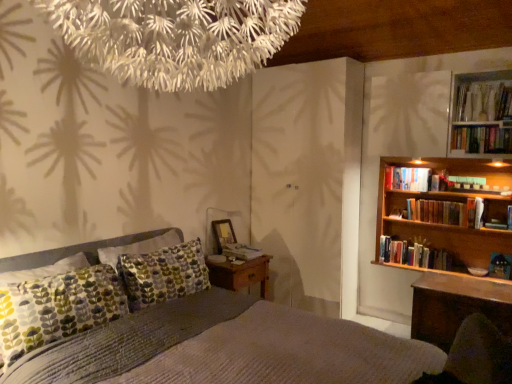
Locate an element on the screen. hardcover books at upper right, the fifth book positioned from the left is located at coordinates (481, 139).

Where is `textured gray bed at center`? This screenshot has height=384, width=512. textured gray bed at center is located at coordinates (229, 348).

Describe the element at coordinates (437, 212) in the screenshot. I see `hardcover books at right, which is the 3th book in bottom-to-top order` at that location.

Locate an element on the screen. hardcover book at bedside, the 6th book in the right-to-left sequence is located at coordinates (241, 252).

In the scene shown: Is wooden table at right not near textured gray bed at center?

Yes, wooden table at right and textured gray bed at center are quite far apart.

Find the location of `table that appears on the right of textured gray bed at center`. table that appears on the right of textured gray bed at center is located at coordinates (456, 306).

Does textured gray bed at center have a greater height compared to hardcover books at upper right, marked as the 6th book in a left-to-right arrangement?

Indeed, textured gray bed at center has a greater height compared to hardcover books at upper right, marked as the 6th book in a left-to-right arrangement.

Measure the distance between textured gray bed at center and hardcover books at upper right, marked as the 6th book in a left-to-right arrangement.

They are 7.17 feet apart.

In the image, there is a hardcover books at upper right, the first book when ordered from right to left. Identify the location of bed below it (from the image's perspective). (229, 348).

Identify the location of book that is the 4th one when counting upward from the textured gray bed at center (from the image's perspective). Image resolution: width=512 pixels, height=384 pixels. (408, 179).

From the image's perspective, is hardcover book at upper right, which is the second book in left-to-right order, on top of textured gray bed at center?

Yes, from the image's perspective, hardcover book at upper right, which is the second book in left-to-right order, is above textured gray bed at center.

In the image, is hardcover book at upper right, which ranks as the fourth book in bottom-to-top order, positioned in front of or behind textured gray bed at center?

In the image, hardcover book at upper right, which ranks as the fourth book in bottom-to-top order, appears behind textured gray bed at center.

From the picture: Is hardcover book at upper right, the third book from the top, facing away from textured gray bed at center?

No, hardcover book at upper right, the third book from the top,'s orientation is not away from textured gray bed at center.

Is textured gray bed at center bigger or smaller than wooden table at right?

textured gray bed at center is bigger than wooden table at right.

The height and width of the screenshot is (384, 512). I want to click on bed above the wooden table at right (from a real-world perspective), so click(x=229, y=348).

Considering the sizes of objects textured gray bed at center and wooden table at right in the image provided, who is wider, textured gray bed at center or wooden table at right?

Wider between the two is textured gray bed at center.

Is textured gray bed at center positioned with its back to wooden table at right?

That's not correct — textured gray bed at center is not looking away from wooden table at right.

From the image's perspective, is wooden table at right located beneath wooden bookshelf at right, the 1th book from the bottom?

Indeed, from the image's perspective, wooden table at right is shown beneath wooden bookshelf at right, the 1th book from the bottom.

Which is closer to the camera, (437, 342) or (435, 264)?

Point (437, 342) appears to be closer to the viewer than point (435, 264).

What's the angular difference between wooden table at right and wooden bookshelf at right, placed as the third book when sorted from left to right,'s facing directions?

The angular difference between wooden table at right and wooden bookshelf at right, placed as the third book when sorted from left to right, is 0.00394 degrees.

The height and width of the screenshot is (384, 512). Identify the location of the 5th book behind the wooden table at right, starting your count from the anchor. (414, 254).

How different are the orientations of textured gray bed at center and hardcover books at right, which is the 3th book in bottom-to-top order, in degrees?

The facing directions of textured gray bed at center and hardcover books at right, which is the 3th book in bottom-to-top order, are 89.9 degrees apart.

Can hardcover books at right, the third book when ordered from right to left, be found inside textured gray bed at center?

Actually, hardcover books at right, the third book when ordered from right to left, is outside textured gray bed at center.

Is the position of textured gray bed at center less distant than that of hardcover books at right, the third book when ordered from right to left?

Yes, textured gray bed at center is closer to the viewer.

Considering the relative sizes of wooden table at right and wooden bookshelf at right in the image provided, is wooden table at right wider than wooden bookshelf at right?

Indeed, wooden table at right has a greater width compared to wooden bookshelf at right.

Is wooden table at right oriented away from wooden bookshelf at right?

No, wooden bookshelf at right is not at the back of wooden table at right.

Does wooden table at right have a smaller size compared to wooden bookshelf at right?

Correct, wooden table at right occupies less space than wooden bookshelf at right.

There is a wooden table at right. Where is `bookcase above it (from a real-world perspective)`? The image size is (512, 384). bookcase above it (from a real-world perspective) is located at coordinates (448, 200).

The height and width of the screenshot is (384, 512). I want to click on table on the right of textured gray bed at center, so click(x=456, y=306).

This screenshot has width=512, height=384. In order to click on bed below the hardcover books at upper right, acting as the first book starting from the top (from the image's perspective) in this screenshot , I will do `click(229, 348)`.

When comparing their distances from hardcover books at upper right, acting as the sixth book starting from the bottom, does wooden bookshelf at right or wooden bookshelf at right, the 1th book from the bottom, seem further?

Based on the image, wooden bookshelf at right, the 1th book from the bottom, appears to be further to hardcover books at upper right, acting as the sixth book starting from the bottom.

Considering their positions, is hardcover books at upper right, which is counted as the 2th book, starting from the right, positioned closer to wooden bookshelf at right, which is the 6th book in top-to-bottom order, than hardcover book at bedside, the 6th book in the right-to-left sequence?

hardcover books at upper right, which is counted as the 2th book, starting from the right, lies closer to wooden bookshelf at right, which is the 6th book in top-to-bottom order, than the other object.

Which object lies nearer to the anchor point textured gray bed at center, hardcover book at upper right, which ranks as the fourth book in bottom-to-top order, or hardcover book at bedside, the 2th book when ordered from bottom to top?

Based on the image, hardcover book at bedside, the 2th book when ordered from bottom to top, appears to be nearer to textured gray bed at center.

Looking at the image, which one is located further to hardcover books at upper right, the first book when ordered from right to left, textured gray bed at center or wooden table at right?

textured gray bed at center lies further to hardcover books at upper right, the first book when ordered from right to left, than the other object.

Based on their spatial positions, is hardcover books at upper right, acting as the sixth book starting from the bottom, or hardcover books at upper right, arranged as the second book when viewed from the top, closer to hardcover book at upper right, which is the second book in left-to-right order?

Among the two, hardcover books at upper right, arranged as the second book when viewed from the top, is located nearer to hardcover book at upper right, which is the second book in left-to-right order.

Looking at this image, based on their spatial positions, is hardcover books at right, positioned as the 4th book in top-to-bottom order, or textured gray bed at center further from wooden bookshelf at right, marked as the fourth book in a right-to-left arrangement?

Based on the image, textured gray bed at center appears to be further to wooden bookshelf at right, marked as the fourth book in a right-to-left arrangement.

From the image, which object appears to be farther from hardcover book at bedside, the 1th book viewed from the left, hardcover books at upper right, the first book when ordered from right to left, or textured gray bed at center?

hardcover books at upper right, the first book when ordered from right to left.

Considering their positions, is textured gray bed at center positioned closer to hardcover book at bedside, the 6th book in the right-to-left sequence, than wooden picture frame at center?

wooden picture frame at center.

At what (x,y) coordinates should I click in order to perform the action: click on book located between hardcover book at bedside, which is the fifth book in top-to-bottom order, and wooden bookshelf at right, placed as the third book when sorted from left to right, in the left-right direction. Please return your answer as a coordinate pair (x, y). Looking at the image, I should click on (408, 179).

At what (x,y) coordinates should I click in order to perform the action: click on bookcase located between textured gray bed at center and wooden picture frame at center in the depth direction. Please return your answer as a coordinate pair (x, y). The height and width of the screenshot is (384, 512). Looking at the image, I should click on (448, 200).

In order to click on bookcase between hardcover book at upper right, which ranks as the fourth book in bottom-to-top order, and wooden table at right, in the vertical direction in this screenshot , I will do `click(448, 200)`.

The image size is (512, 384). What are the coordinates of `table between wooden picture frame at center and hardcover books at upper right, the 5th book when ordered from bottom to top, in the horizontal direction` in the screenshot? It's located at (456, 306).